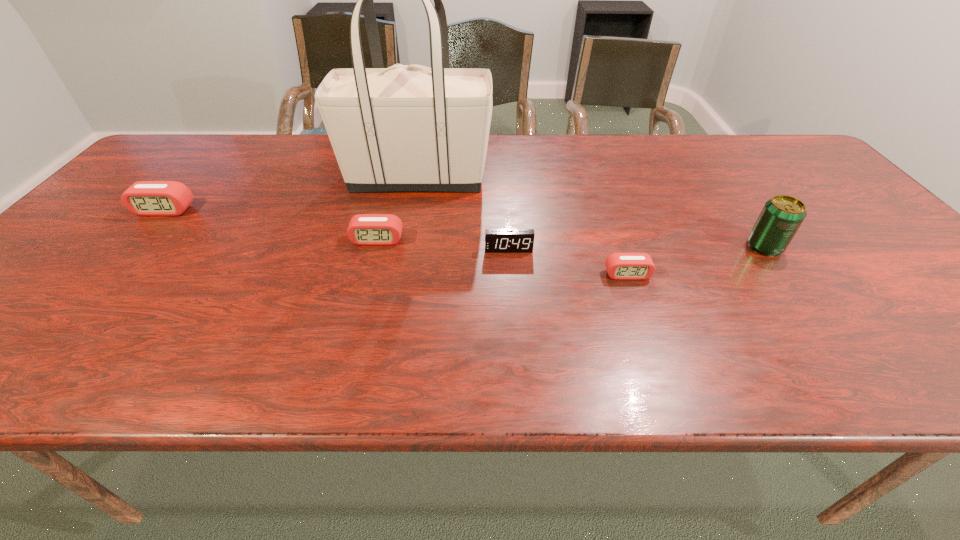
At what (x,y) coordinates should I click in order to perform the action: click on the farthest alarm clock. Please return your answer as a coordinate pair (x, y). This screenshot has height=540, width=960. Looking at the image, I should click on (144, 198).

This screenshot has height=540, width=960. What are the coordinates of `the tallest alarm clock` in the screenshot? It's located at (144, 198).

The image size is (960, 540). Find the location of `the second alarm clock from left to right`. the second alarm clock from left to right is located at coordinates (364, 229).

Image resolution: width=960 pixels, height=540 pixels. Find the location of `the shortest alarm clock`. the shortest alarm clock is located at coordinates (620, 266).

This screenshot has width=960, height=540. In order to click on the nearest object in this screenshot , I will do `click(620, 266)`.

Locate an element on the screen. The image size is (960, 540). the tallest object is located at coordinates (412, 128).

At what (x,y) coordinates should I click in order to perform the action: click on the farthest object. Please return your answer as a coordinate pair (x, y). This screenshot has width=960, height=540. Looking at the image, I should click on (412, 128).

This screenshot has height=540, width=960. I want to click on the rightmost object, so click(782, 215).

Identify the location of beer can. (782, 215).

Locate an element on the screen. This screenshot has height=540, width=960. the third alarm clock from left to right is located at coordinates click(x=496, y=240).